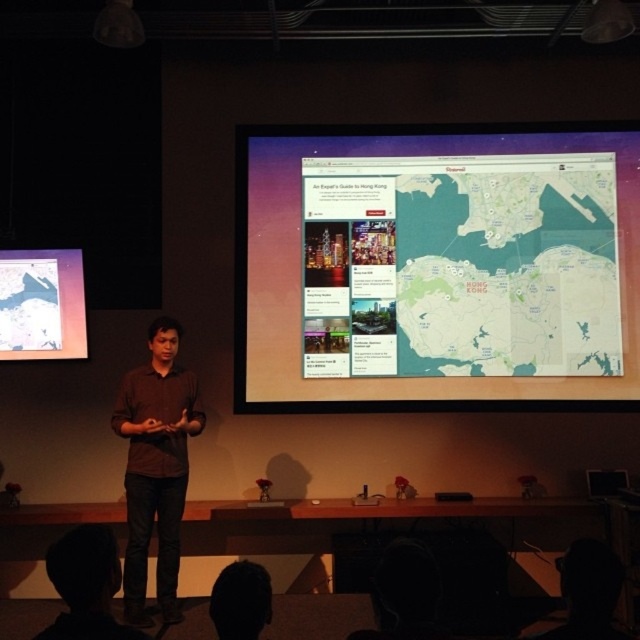
Question: Does brown shirt at center have a larger size compared to dark brown hair at lower center?

Choices:
 (A) no
 (B) yes

Answer: (B)

Question: Is dark brown shirt at center bigger than dark brown hair at lower center?

Choices:
 (A) yes
 (B) no

Answer: (A)

Question: Which object is the closest to the dark brown hair at lower center?

Choices:
 (A) white glossy map at upper left
 (B) matte white map at center

Answer: (A)

Question: Does matte white map at center have a smaller size compared to brown shirt at center?

Choices:
 (A) yes
 (B) no

Answer: (B)

Question: Among these objects, which one is farthest from the camera?

Choices:
 (A) brown shirt at center
 (B) dark brown shirt at center
 (C) matte white map at center

Answer: (C)

Question: Estimate the real-world distances between objects in this image. Which object is closer to the matte white map at center?

Choices:
 (A) brown shirt at center
 (B) dark brown hair at lower center
 (C) white glossy map at upper left

Answer: (A)